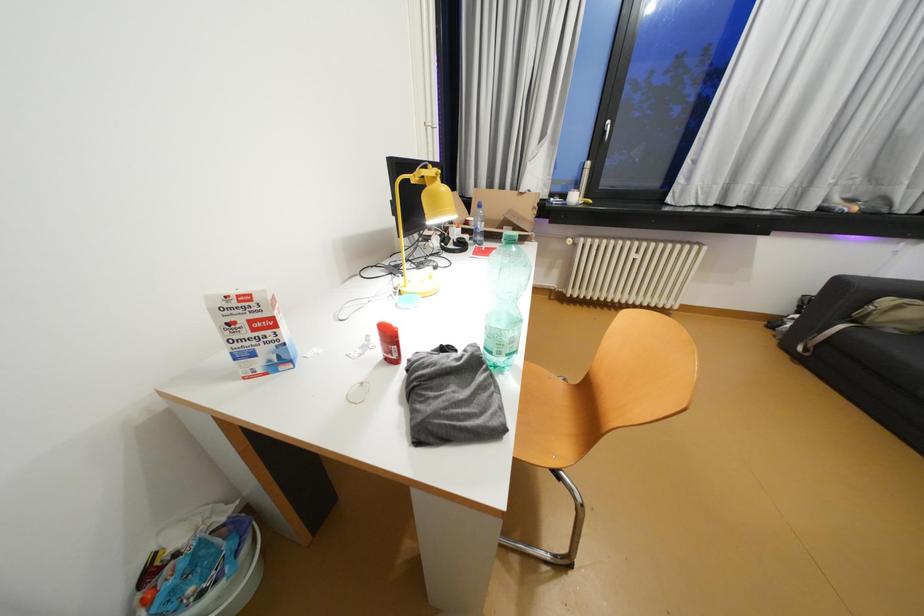
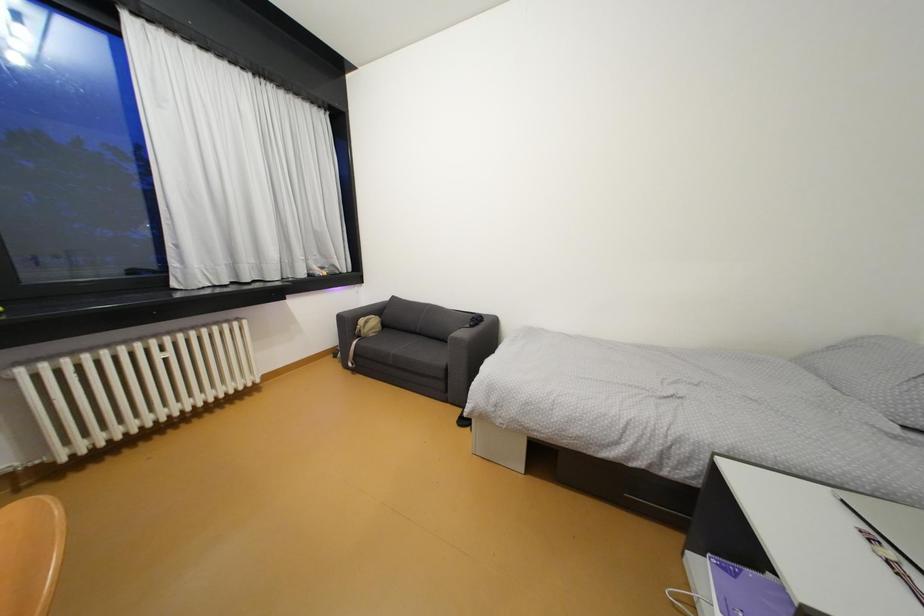
Question: Based on the continuous images, in which direction is the camera rotating? Reply with the corresponding letter.

Choices:
 (A) Left
 (B) Right
 (C) Up
 (D) Down

Answer: (B)